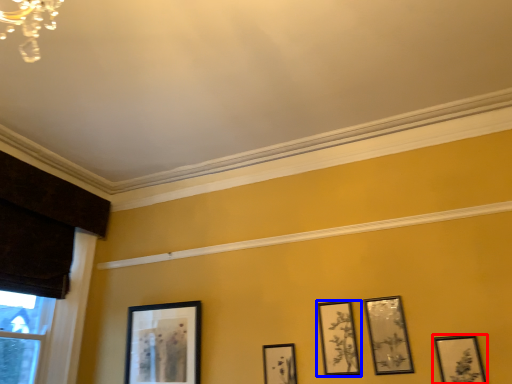
Question: Which object is closer to the camera taking this photo, picture frame (highlighted by a red box) or picture frame (highlighted by a blue box)?

Choices:
 (A) picture frame
 (B) picture frame

Answer: (A)